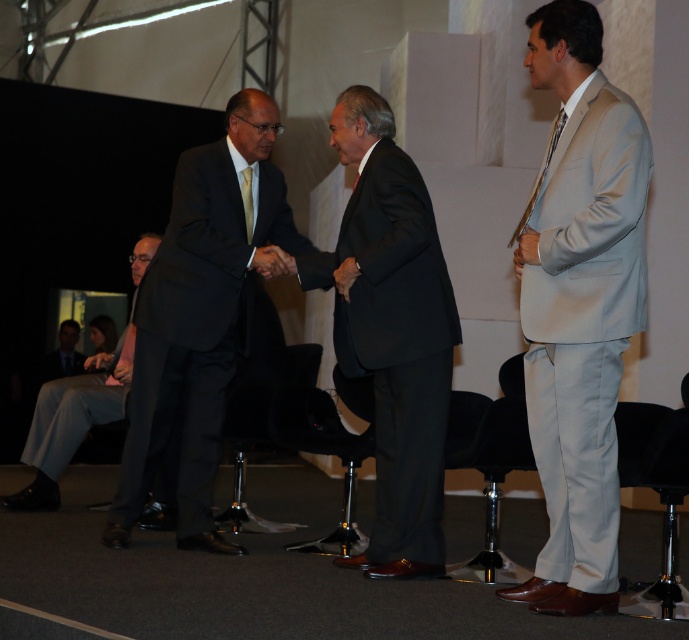
Question: Among these points, which one is nearest to the camera?

Choices:
 (A) (52, 356)
 (B) (387, 225)

Answer: (B)

Question: From the image, what is the correct spatial relationship of light gray suit at right in relation to matte black suit at center?

Choices:
 (A) right
 (B) left

Answer: (A)

Question: Is light gray suit at right below matte black suit at center?

Choices:
 (A) yes
 (B) no

Answer: (B)

Question: Which of the following is the closest to the observer?

Choices:
 (A) (127, 339)
 (B) (390, 552)
 (C) (54, 353)
 (D) (232, 228)

Answer: (B)

Question: Which of the following is the closest to the observer?

Choices:
 (A) (65, 358)
 (B) (426, 440)

Answer: (B)

Question: Can you confirm if black matte suit at center is positioned above light gray suit at lower left?

Choices:
 (A) no
 (B) yes

Answer: (B)